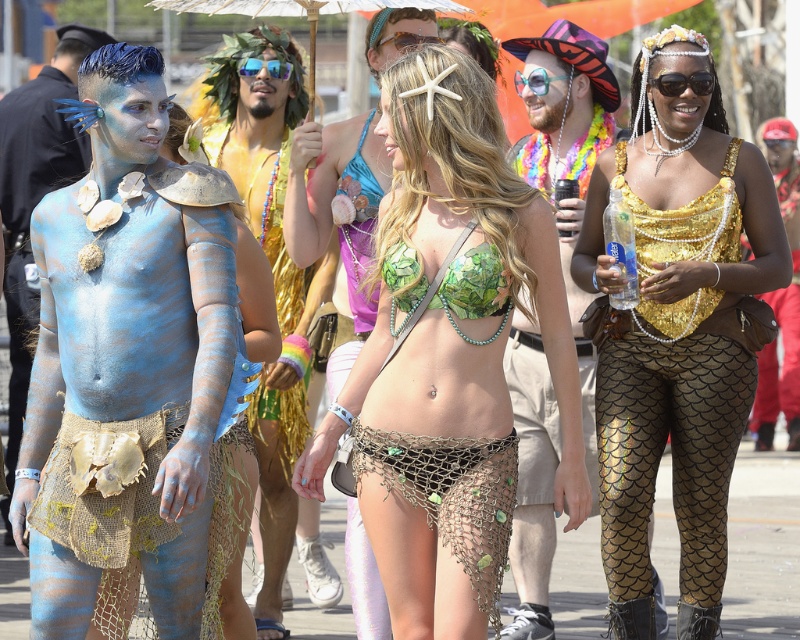
You are a photographer trying to capture the vibrant festival scene. You notice the green leafy fabric bikini top at center and the white paper umbrella at upper center. Which object should you focus on first if you want to take a clear photo without adjusting your camera focus?

The green leafy fabric bikini top at center is closer to the viewer than the white paper umbrella at upper center, so focusing on the bikini top first would ensure clarity since it is nearer.

You are a photographer at the festival and want to capture both the green leafy fabric bikini top at center and the blue reflective sunglasses at center in a single shot. Which object should you focus on first to ensure both are in frame?

The green leafy fabric bikini top at center is taller than the blue reflective sunglasses at center, so focusing on the taller object first will ensure both are in frame.

You are a photographer at the festival trying to capture the person in the green leafy fabric bikini top at center. Since you want to ensure they are shaded from the bright sunlight, will the white paper umbrella at upper center provide them with shade?

The green leafy fabric bikini top at center is positioned under the white paper umbrella at upper center, so yes, the umbrella will provide shade for the person wearing the green leafy fabric bikini top at center.